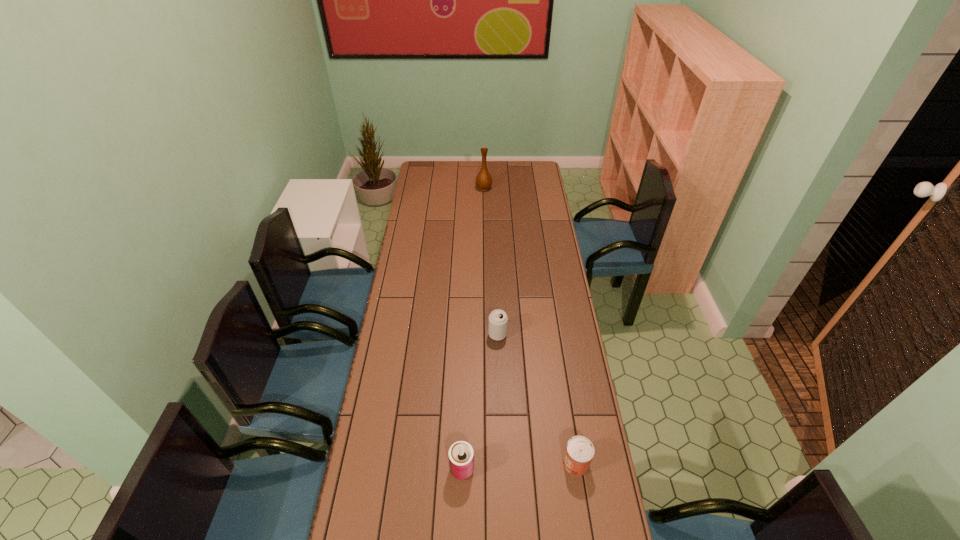
The width and height of the screenshot is (960, 540). I want to click on vacant area that lies between the rightmost object and the farthest can, so click(x=537, y=399).

Where is `empty space that is in between the leftmost can and the rightmost can`? empty space that is in between the leftmost can and the rightmost can is located at coordinates (519, 466).

Locate an element on the screen. This screenshot has height=540, width=960. empty location between the farthest can and the rightmost object is located at coordinates (537, 399).

Where is `vacant area that lies between the leftmost can and the second can from right to left`? vacant area that lies between the leftmost can and the second can from right to left is located at coordinates (480, 402).

Identify which object is the third closest to the second can from right to left. Please provide its 2D coordinates. Your answer should be formatted as a tuple, i.e. [(x, y)], where the tuple contains the x and y coordinates of a point satisfying the conditions above.

[(484, 181)]

Locate which object ranks second in proximity to the rightmost can. Please provide its 2D coordinates. Your answer should be formatted as a tuple, i.e. [(x, y)], where the tuple contains the x and y coordinates of a point satisfying the conditions above.

[(498, 319)]

The width and height of the screenshot is (960, 540). I want to click on can that is the closest one to the third nearest object, so click(x=461, y=455).

Locate an element on the screen. This screenshot has width=960, height=540. the second closest can relative to the rightmost can is located at coordinates (498, 319).

You are a GUI agent. You are given a task and a screenshot of the screen. Output one action in this format:
    pyautogui.click(x=<x>, y=<y>)
    Task: Click on the vacant point that satisfies the following two spatial constraints: 1. on the front side of the third nearest object; 2. on the right side of the rightmost can
    This screenshot has height=540, width=960.
    Given the screenshot: What is the action you would take?
    pyautogui.click(x=502, y=463)

The width and height of the screenshot is (960, 540). I want to click on free location that satisfies the following two spatial constraints: 1. on the front side of the second can from left to right; 2. on the right side of the farthest object, so click(x=486, y=334).